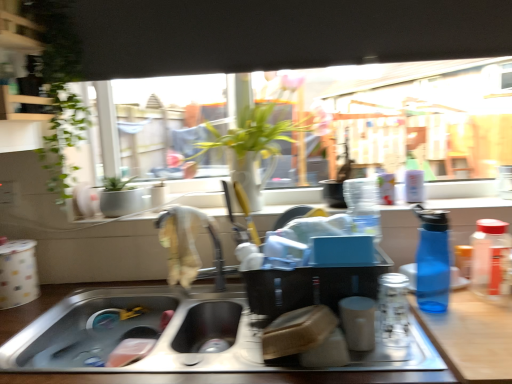
At what (x,y) coordinates should I click in order to perform the action: click on space that is in front of clear glass jar at center, the 3th bottle in the right-to-left sequence. Please return your answer as a coordinate pair (x, y). Looking at the image, I should click on (416, 361).